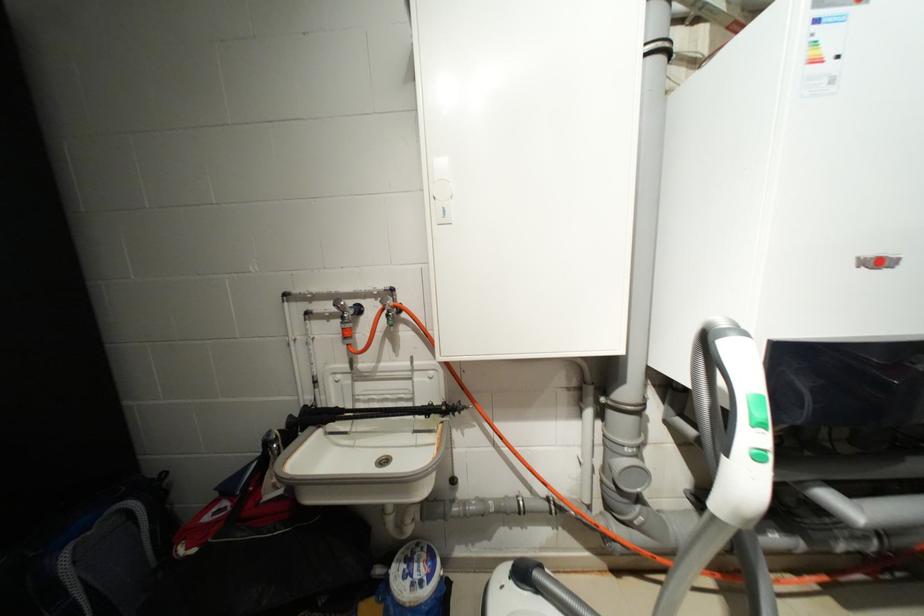
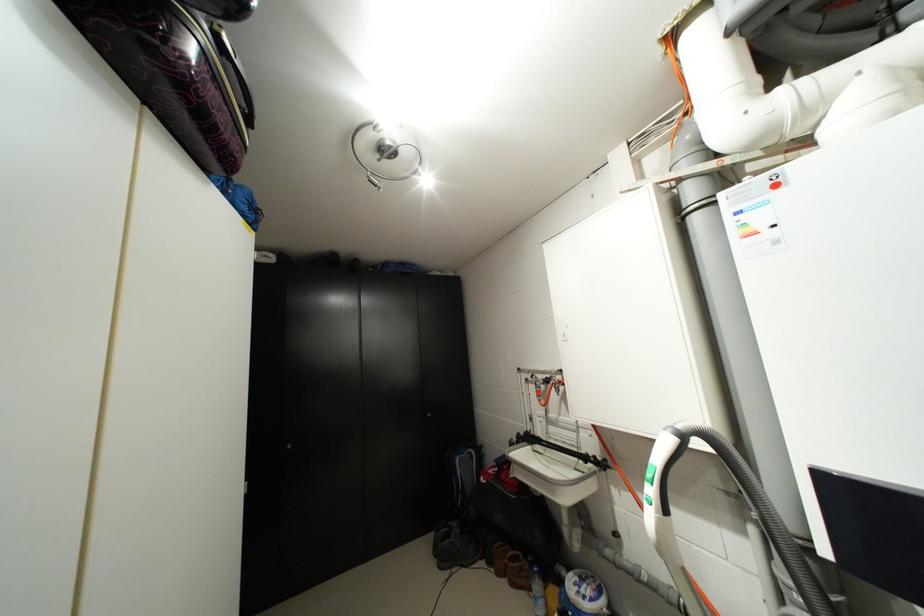
The point at (x=359, y=313) is marked in the first image. Where is the corresponding point in the second image?

(549, 383)